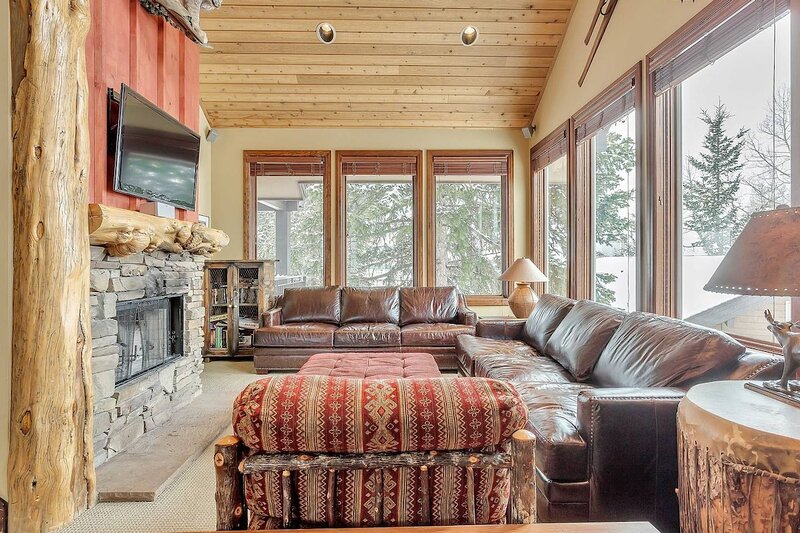
This screenshot has width=800, height=533. Identify the location of fireplace. (149, 335).